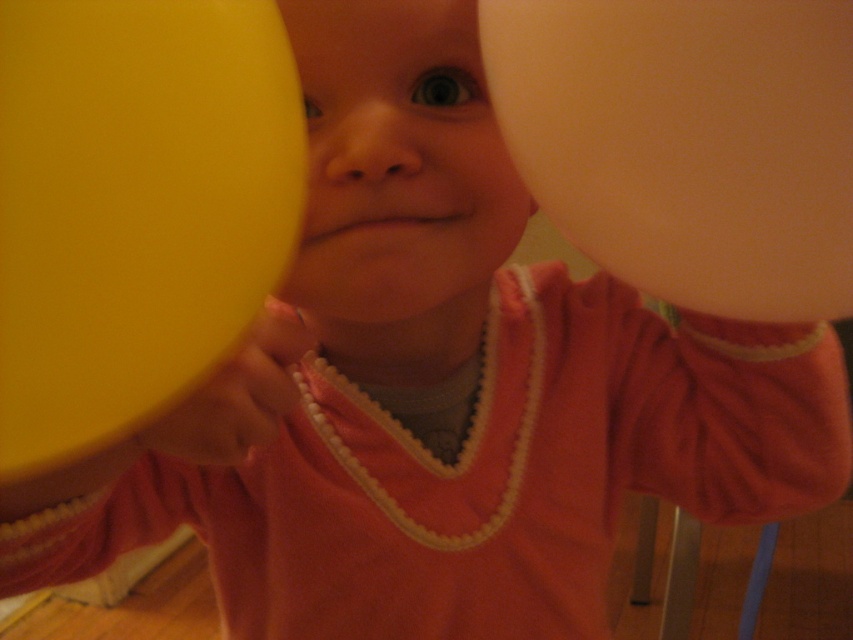
The height and width of the screenshot is (640, 853). Describe the element at coordinates (688, 141) in the screenshot. I see `matte white balloon at right` at that location.

Between matte white balloon at right and smooth skin face at center, which one has more height?

smooth skin face at center

Find the location of `matte white balloon at right`. matte white balloon at right is located at coordinates (688, 141).

Is point (195, 32) closer to camera compared to point (410, 125)?

Yes, point (195, 32) is closer to viewer.

What do you see at coordinates (132, 209) in the screenshot?
I see `yellow rubber balloon at left` at bounding box center [132, 209].

Between point (238, 257) and point (425, 272), which one is positioned behind?

Point (425, 272)

Where is `yellow rubber balloon at left`? Image resolution: width=853 pixels, height=640 pixels. yellow rubber balloon at left is located at coordinates (132, 209).

In the scene shown: Who is more forward, (67, 3) or (773, 52)?

Point (67, 3)

Can you confirm if yellow rubber balloon at left is taller than matte white balloon at right?

Indeed, yellow rubber balloon at left has a greater height compared to matte white balloon at right.

Image resolution: width=853 pixels, height=640 pixels. What do you see at coordinates (132, 209) in the screenshot?
I see `yellow rubber balloon at left` at bounding box center [132, 209].

At what (x,y) coordinates should I click in order to perform the action: click on yellow rubber balloon at left. Please return your answer as a coordinate pair (x, y). This screenshot has width=853, height=640. Looking at the image, I should click on (132, 209).